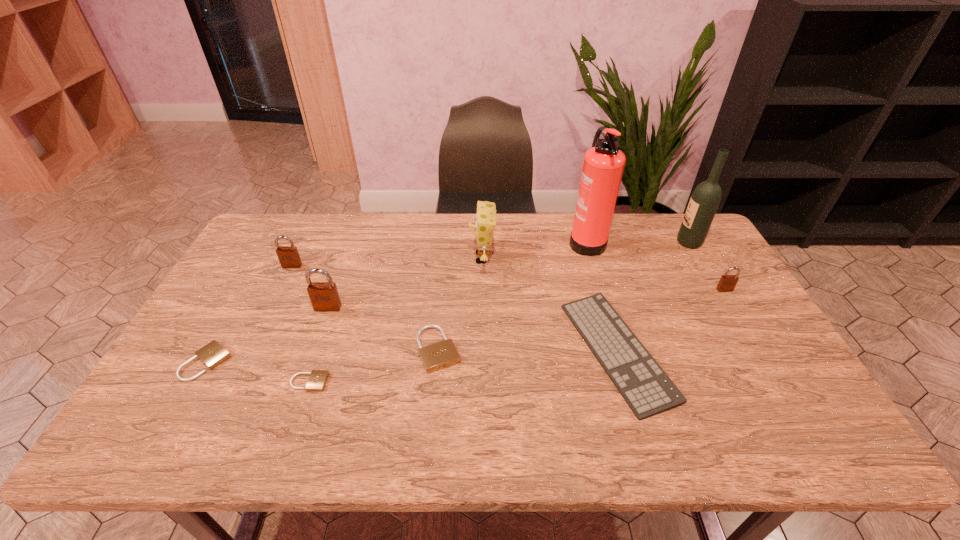
Where is `free spot between the farthest padlock and the rightmost padlock`? free spot between the farthest padlock and the rightmost padlock is located at coordinates (508, 278).

The image size is (960, 540). I want to click on free space between the second biggest brown padlock and the fifth object from right to left, so click(x=387, y=262).

Image resolution: width=960 pixels, height=540 pixels. What are the coordinates of `empty location between the second padlock from left to right and the sixth object from right to left` in the screenshot? It's located at (365, 308).

You are a GUI agent. You are given a task and a screenshot of the screen. Output one action in this format:
    pyautogui.click(x=<x>, y=<y>)
    Task: Click on the vacant space that's between the shortest padlock and the fifth tallest padlock
    The width and height of the screenshot is (960, 540).
    Given the screenshot: What is the action you would take?
    pyautogui.click(x=258, y=372)

Where is `free space between the farthest padlock and the shortest padlock`? The height and width of the screenshot is (540, 960). free space between the farthest padlock and the shortest padlock is located at coordinates (300, 324).

Identify the location of free space between the leftmost beige padlock and the shortest object. The width and height of the screenshot is (960, 540). (258, 372).

I want to click on the fifth closest object relative to the smallest beige padlock, so click(x=485, y=218).

This screenshot has height=540, width=960. I want to click on object that is the second closest to the nearest brown padlock, so click(x=212, y=354).

Identify the location of the second closest padlock to the second tallest object. (442, 354).

Where is `padlock that can be found as the fourth closest to the fifth tallest padlock`? The height and width of the screenshot is (540, 960). padlock that can be found as the fourth closest to the fifth tallest padlock is located at coordinates (442, 354).